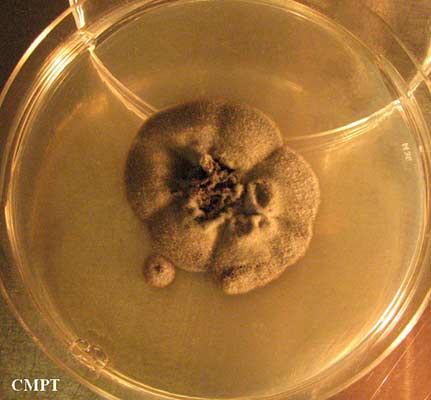
Image resolution: width=431 pixels, height=400 pixels. Find the location of `table`. table is located at coordinates [x=407, y=377].